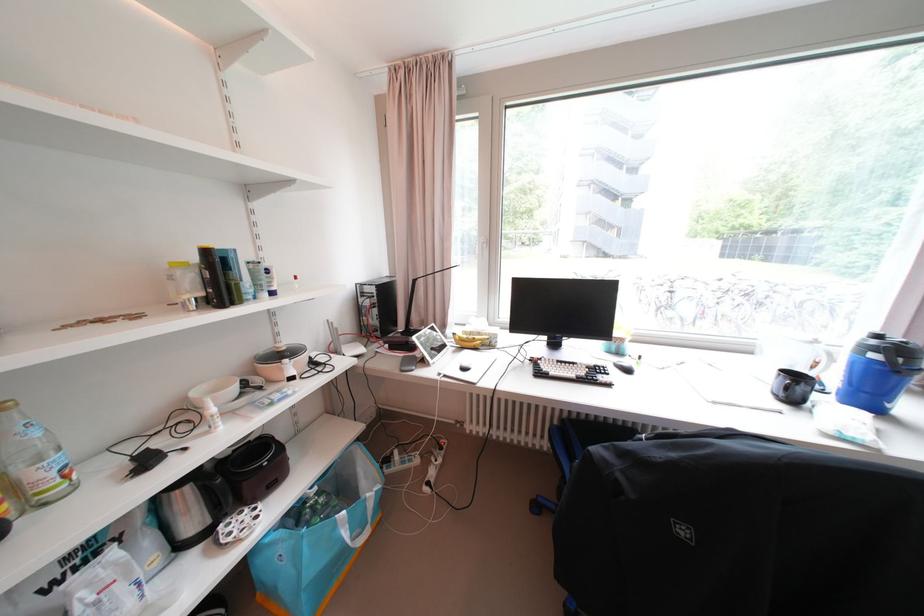
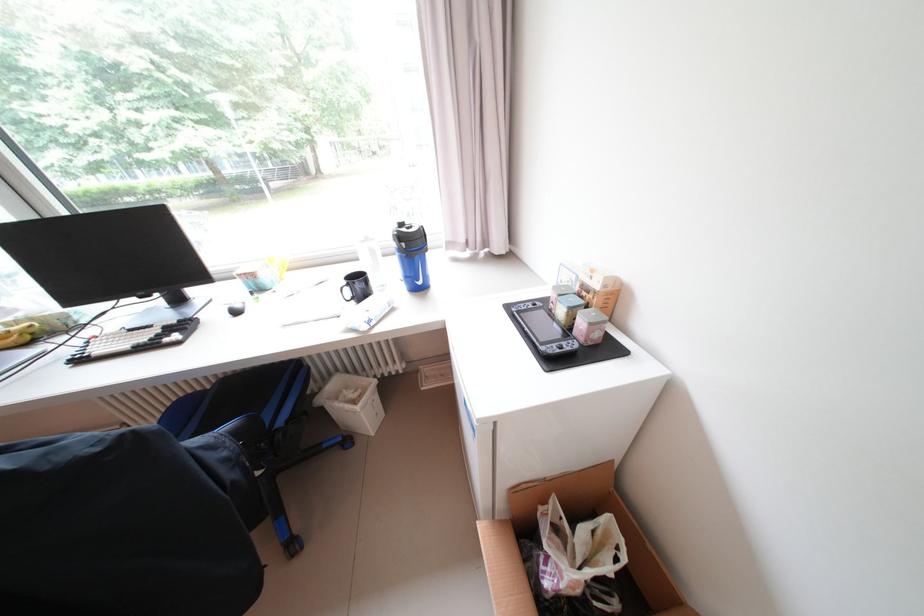
Where in the second image is the point corresponding to (473,334) from the first image?

(15, 326)